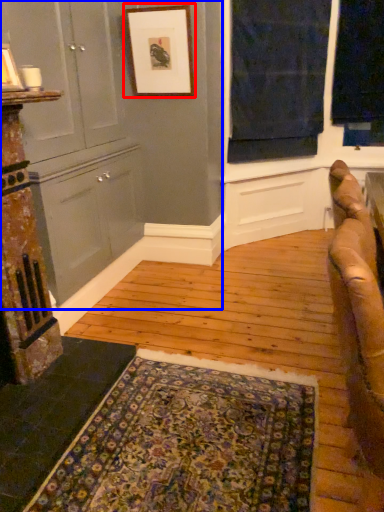
Question: Among these objects, which one is farthest to the camera, picture frame (highlighted by a red box) or dresser (highlighted by a blue box)?

Choices:
 (A) picture frame
 (B) dresser

Answer: (A)